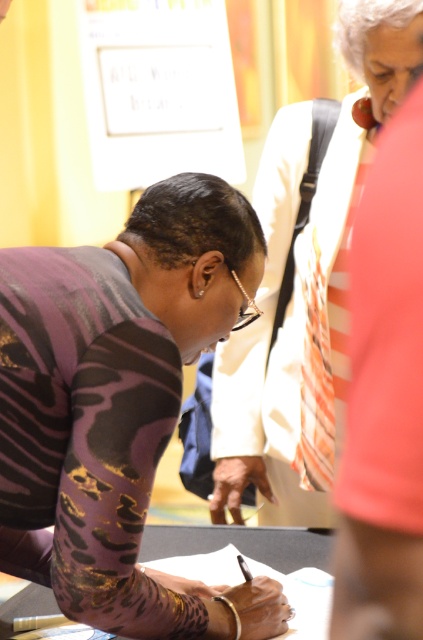
Question: Which object appears closest to the camera in this image?

Choices:
 (A) matte purple blouse at center
 (B) purple metallic shirt at center
 (C) smooth black paper at center

Answer: (B)

Question: Among these points, which one is farthest from the camera?

Choices:
 (A) (290, 433)
 (B) (43, 547)
 (C) (294, 630)

Answer: (A)

Question: Considering the relative positions of matte purple blouse at center and smooth black paper at center in the image provided, where is matte purple blouse at center located with respect to smooth black paper at center?

Choices:
 (A) below
 (B) above

Answer: (B)

Question: Based on their relative distances, which object is nearer to the purple metallic shirt at center?

Choices:
 (A) matte purple blouse at center
 (B) smooth black paper at center

Answer: (B)

Question: Can you confirm if purple metallic shirt at center is positioned to the left of matte purple blouse at center?

Choices:
 (A) no
 (B) yes

Answer: (B)

Question: Does purple metallic shirt at center lie in front of matte purple blouse at center?

Choices:
 (A) no
 (B) yes

Answer: (B)